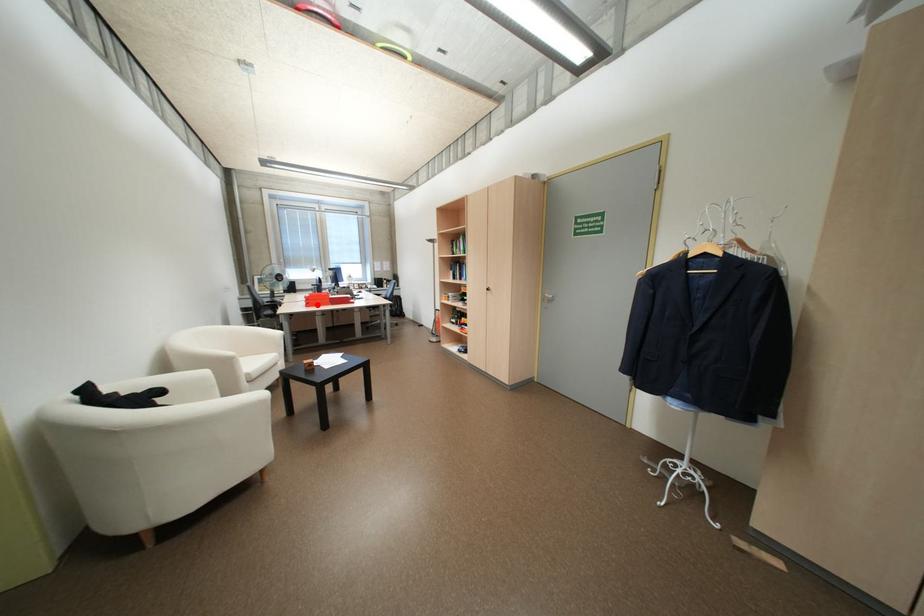
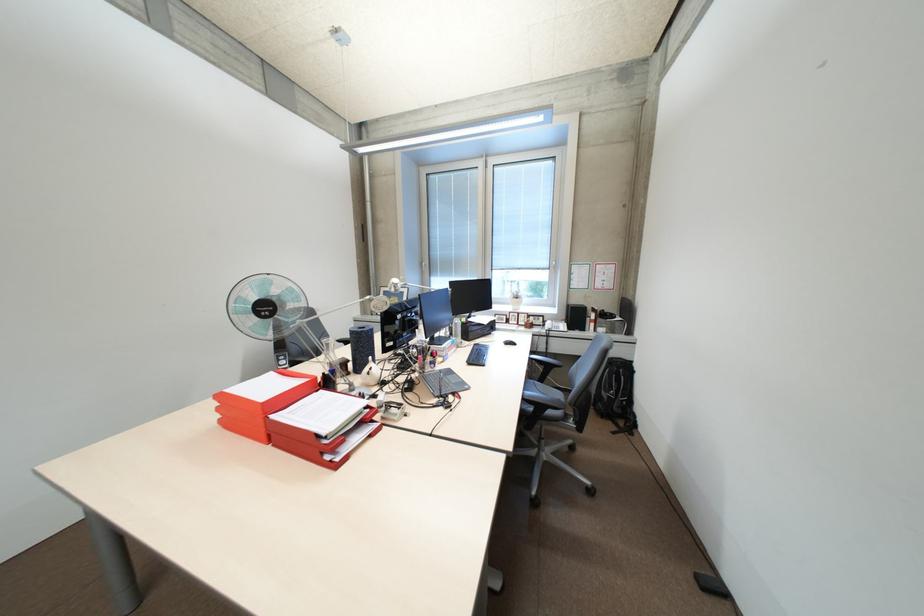
The point at the highlighted location is marked in the first image. Where is the corresponding point in the second image?

(231, 421)